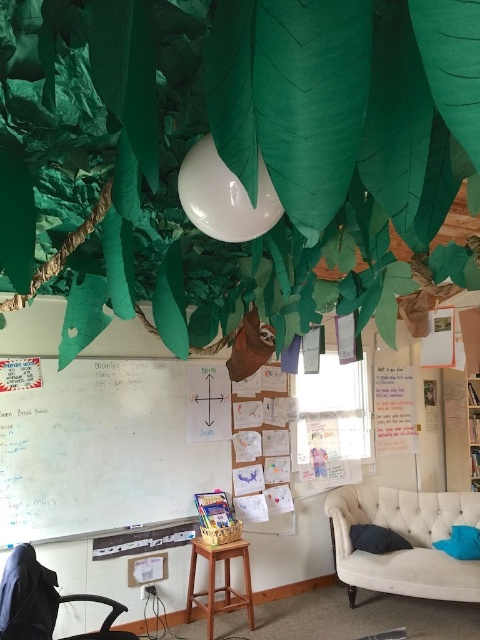
You are a student sitting at the desk in the classroom. You want to look at the whiteboard at left and the dark blue fabric pillow at lower right. Which object is closer to your left side?

The whiteboard at left is to the left of dark blue fabric pillow at lower right, so when sitting at the desk, the whiteboard at left is closer to your left side.

You are sitting on the floor in a classroom decorated with a jungle theme. You want to move to the white tufted couch at lower right to rest. However, there is a dark blue fabric pillow at lower right in your way. Can you step over the pillow to reach the couch?

The white tufted couch at lower right is above the dark blue fabric pillow at lower right, so yes, you can step over the pillow to reach the couch.